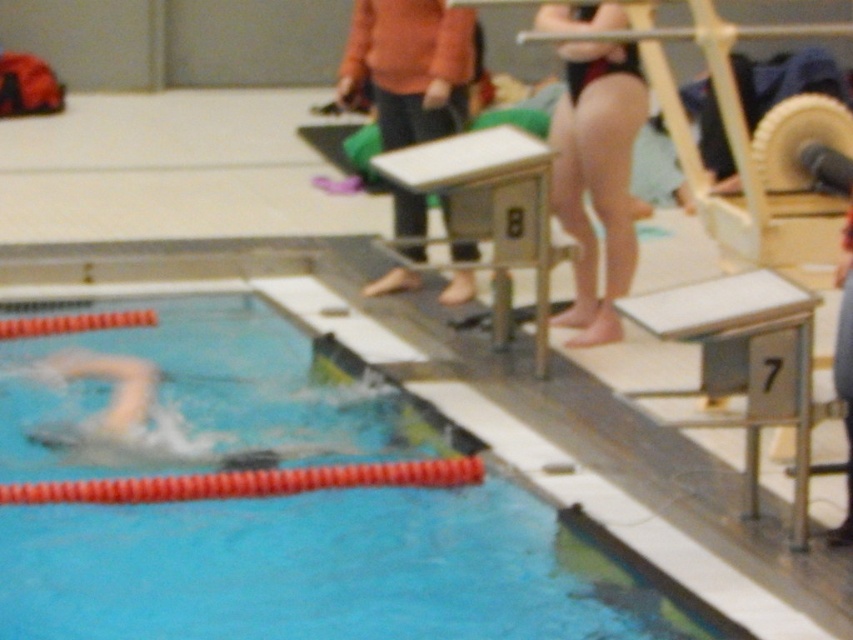
You are a lifeguard observing the pool area. You notice the blue rubber pool lane at lower left and the black swimsuit at upper right. Which object takes up more space in the image?

The blue rubber pool lane at lower left has a larger size compared to the black swimsuit at upper right, so it takes up more space in the image.

You are a swimmer preparing to start your race. You see the blue rubber pool lane at lower left and the black swimsuit at upper right. Which object is closer to the starting block located at the pool edge?

The blue rubber pool lane at lower left is closer to the starting block located at the pool edge because it is positioned to the left of the black swimsuit at upper right, and in a pool setup, lanes are typically aligned along the length with starting blocks at the edge near the lanes.